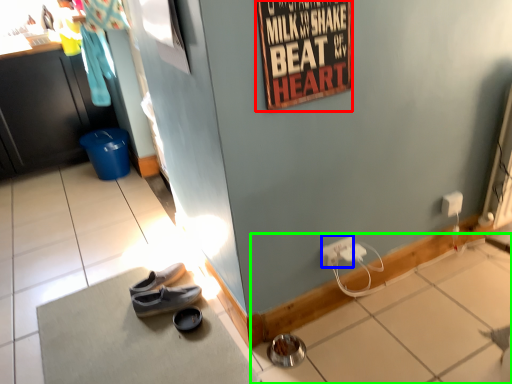
Question: Which object is the closest to the poster page (highlighted by a red box)? Choose among these: power outlet (highlighted by a blue box) or tile (highlighted by a green box).

Choices:
 (A) power outlet
 (B) tile

Answer: (A)